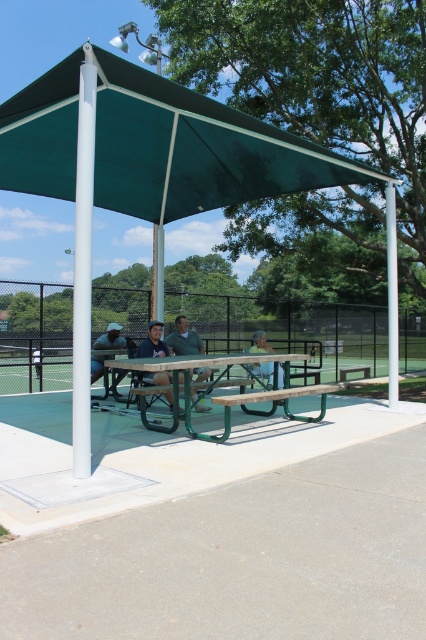
Question: Among these points, which one is farthest from the camera?

Choices:
 (A) (345, 163)
 (B) (106, 339)

Answer: (B)

Question: Which point is closer to the camera?

Choices:
 (A) (124, 340)
 (B) (267, 387)
 (C) (146, 428)

Answer: (C)

Question: Among these points, which one is nearest to the camera?

Choices:
 (A) (252, 348)
 (B) (103, 356)

Answer: (B)

Question: Can you confirm if green plastic picnic table at center is bigger than green fabric umbrella at upper left?

Choices:
 (A) yes
 (B) no

Answer: (A)

Question: Is green fabric canopy at center positioned behind green fabric umbrella at upper left?

Choices:
 (A) yes
 (B) no

Answer: (B)

Question: Does light blue fabric at center have a lesser width compared to green fabric umbrella at upper left?

Choices:
 (A) no
 (B) yes

Answer: (A)